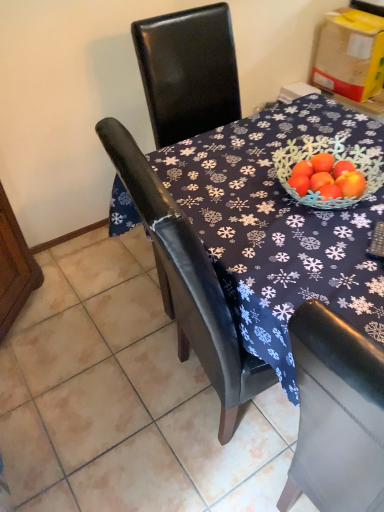
Locate an element on the screen. The width and height of the screenshot is (384, 512). matte black chair at center is located at coordinates (124, 398).

This screenshot has height=512, width=384. What do you see at coordinates (124, 398) in the screenshot? I see `matte black chair at center` at bounding box center [124, 398].

This screenshot has height=512, width=384. What do you see at coordinates (350, 54) in the screenshot?
I see `yellow cardboard box at upper right` at bounding box center [350, 54].

In order to face yellow cardboard box at upper right, should I rotate leftwards or rightwards?

To align with it, rotate right about 20.328°.

What is the approximate width of yellow cardboard box at upper right?

yellow cardboard box at upper right is 15.20 inches wide.

You are a GUI agent. You are given a task and a screenshot of the screen. Output one action in this format:
    pyautogui.click(x=<x>, y=<y>)
    Task: Click on the yellow cardboard box at upper right
    This screenshot has height=512, width=384.
    Given the screenshot: What is the action you would take?
    pyautogui.click(x=350, y=54)

You are a GUI agent. You are given a task and a screenshot of the screen. Output one action in this format:
    pyautogui.click(x=<x>, y=<y>)
    Task: Click on the matte black chair at center
    The width and height of the screenshot is (384, 512).
    Given the screenshot: What is the action you would take?
    pyautogui.click(x=124, y=398)

Is matte black chair at center to the right of yellow cardboard box at upper right from the viewer's perspective?

In fact, matte black chair at center is to the left of yellow cardboard box at upper right.

Which is behind, matte black chair at center or yellow cardboard box at upper right?

yellow cardboard box at upper right is further from the camera.

Does point (48, 308) appear closer or farther from the camera than point (368, 69)?

Point (48, 308) appears to be closer to the viewer than point (368, 69).

From the image's perspective, between matte black chair at center and yellow cardboard box at upper right, who is located below?

matte black chair at center is shown below in the image.

From a real-world perspective, is matte black chair at center physically located above or below yellow cardboard box at upper right?

matte black chair at center is below yellow cardboard box at upper right.

Which of these two, matte black chair at center or yellow cardboard box at upper right, is thinner?

yellow cardboard box at upper right.

Based on the photo, is matte black chair at center taller than yellow cardboard box at upper right?

In fact, matte black chair at center may be shorter than yellow cardboard box at upper right.

Between matte black chair at center and yellow cardboard box at upper right, which one has smaller size?

yellow cardboard box at upper right.

Is matte black chair at center situated inside yellow cardboard box at upper right or outside?

matte black chair at center is not inside yellow cardboard box at upper right, it's outside.

Is matte black chair at center not near yellow cardboard box at upper right?

Yes, matte black chair at center is far from yellow cardboard box at upper right.

Is matte black chair at center facing away from yellow cardboard box at upper right?

No, matte black chair at center's orientation is not away from yellow cardboard box at upper right.

How many degrees apart are the facing directions of matte black chair at center and yellow cardboard box at upper right?

matte black chair at center and yellow cardboard box at upper right are facing 7.58 degrees away from each other.

How much distance is there between matte black chair at center and yellow cardboard box at upper right?

5.79 feet.

You are a GUI agent. You are given a task and a screenshot of the screen. Output one action in this format:
    pyautogui.click(x=<x>, y=<y>)
    Task: Click on the cardboard box that appears behind the matte black chair at center
    
    Given the screenshot: What is the action you would take?
    pyautogui.click(x=350, y=54)

Is yellow cardboard box at upper right at the right side of matte black chair at center?

Yes.

Is yellow cardboard box at upper right in front of matte black chair at center?

No, it is not.

Considering the points (337, 15) and (112, 323), which point is behind, point (337, 15) or point (112, 323)?

The point (337, 15) is behind.

From the image's perspective, is yellow cardboard box at upper right beneath matte black chair at center?

No, from the image's perspective, yellow cardboard box at upper right is not below matte black chair at center.

From a real-world perspective, who is located higher, yellow cardboard box at upper right or matte black chair at center?

yellow cardboard box at upper right is physically above.

Considering the relative sizes of yellow cardboard box at upper right and matte black chair at center in the image provided, is yellow cardboard box at upper right wider than matte black chair at center?

No.

Considering the relative sizes of yellow cardboard box at upper right and matte black chair at center in the image provided, is yellow cardboard box at upper right taller than matte black chair at center?

Yes, yellow cardboard box at upper right is taller than matte black chair at center.

Consider the image. Based on their sizes in the image, would you say yellow cardboard box at upper right is bigger or smaller than matte black chair at center?

Considering their sizes, yellow cardboard box at upper right takes up less space than matte black chair at center.

Would you say matte black chair at center is part of yellow cardboard box at upper right's contents?

That's incorrect, matte black chair at center is not inside yellow cardboard box at upper right.

Would you consider yellow cardboard box at upper right to be distant from matte black chair at center?

Absolutely, yellow cardboard box at upper right is distant from matte black chair at center.

Is yellow cardboard box at upper right oriented away from matte black chair at center?

yellow cardboard box at upper right does not have its back to matte black chair at center.

Can you tell me how much yellow cardboard box at upper right and matte black chair at center differ in facing direction?

The facing directions of yellow cardboard box at upper right and matte black chair at center are 7.58 degrees apart.

Where is `cardboard box that appears on the right of matte black chair at center`? The width and height of the screenshot is (384, 512). cardboard box that appears on the right of matte black chair at center is located at coordinates (350, 54).

Locate an element on the screen. cardboard box above the matte black chair at center (from the image's perspective) is located at coordinates (350, 54).

The image size is (384, 512). What are the coordinates of `tile below the yellow cardboard box at upper right (from a real-world perspective)` in the screenshot? It's located at (124, 398).